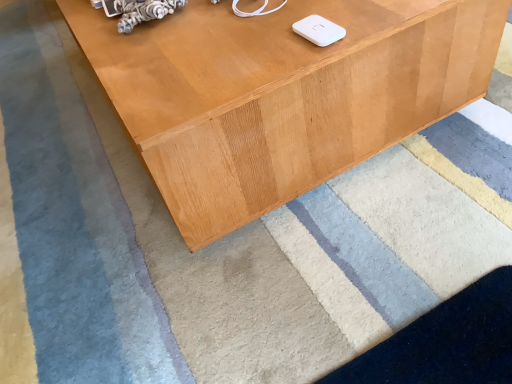
Question: From the image's perspective, is light brown wood table at center positioned above or below white matte ipod at upper center?

Choices:
 (A) below
 (B) above

Answer: (B)

Question: Considering the relative positions of light brown wood table at center and white matte ipod at upper center in the image provided, is light brown wood table at center to the left or to the right of white matte ipod at upper center?

Choices:
 (A) left
 (B) right

Answer: (A)

Question: From a real-world perspective, is light brown wood table at center positioned above or below white matte ipod at upper center?

Choices:
 (A) below
 (B) above

Answer: (A)

Question: Based on their sizes in the image, would you say white matte ipod at upper center is bigger or smaller than light brown wood table at center?

Choices:
 (A) big
 (B) small

Answer: (B)

Question: In terms of width, does white matte ipod at upper center look wider or thinner when compared to light brown wood table at center?

Choices:
 (A) thin
 (B) wide

Answer: (A)

Question: From their relative heights in the image, would you say white matte ipod at upper center is taller or shorter than light brown wood table at center?

Choices:
 (A) short
 (B) tall

Answer: (A)

Question: Considering the positions of point (316, 26) and point (146, 79), is point (316, 26) closer or farther from the camera than point (146, 79)?

Choices:
 (A) farther
 (B) closer

Answer: (B)